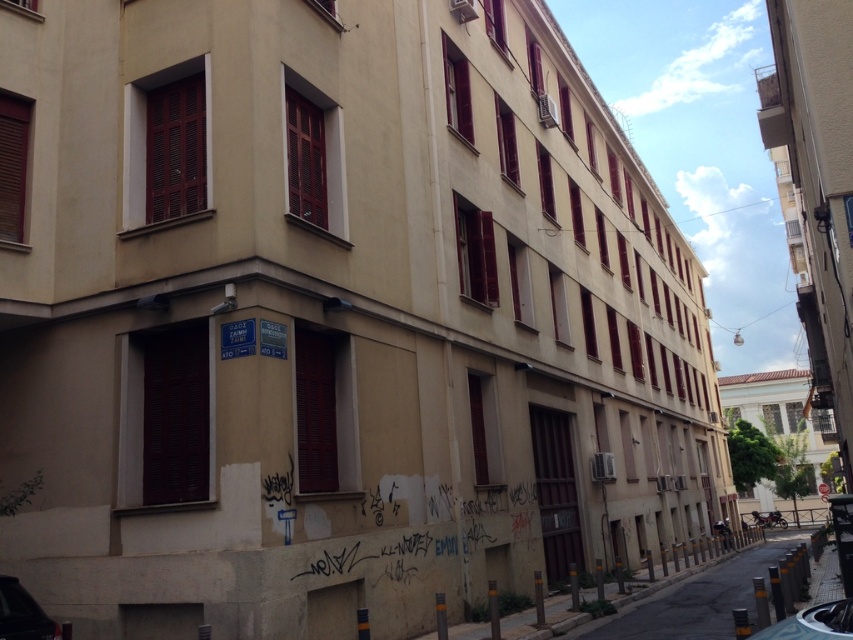
Question: Which point is closer to the camera?

Choices:
 (A) shiny black car at lower left
 (B) concrete sidewalk at lower right
 (C) silver metallic car at lower right

Answer: (C)

Question: Which point is farther to the camera?

Choices:
 (A) shiny black car at lower left
 (B) silver metallic car at lower right
 (C) concrete sidewalk at lower right

Answer: (C)

Question: Can you confirm if shiny black car at lower left is positioned below silver metallic car at lower right?

Choices:
 (A) no
 (B) yes

Answer: (B)

Question: Does concrete sidewalk at lower right have a larger size compared to shiny black car at lower left?

Choices:
 (A) yes
 (B) no

Answer: (A)

Question: Among these points, which one is farthest from the camera?

Choices:
 (A) tap(747, 602)
 (B) tap(825, 618)
 (C) tap(9, 598)

Answer: (A)

Question: Can you confirm if shiny black car at lower left is positioned to the left of silver metallic car at lower right?

Choices:
 (A) no
 (B) yes

Answer: (B)